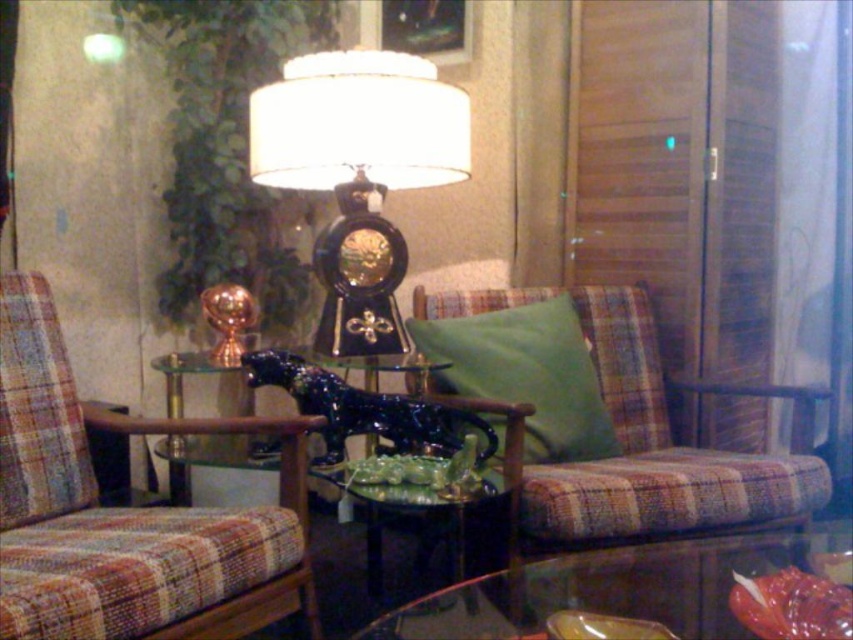
Can you confirm if green glossy side table at center is positioned to the right of shiny dark blue statue at center?

Correct, you'll find green glossy side table at center to the right of shiny dark blue statue at center.

Does green glossy side table at center appear on the left side of shiny dark blue statue at center?

No, green glossy side table at center is not to the left of shiny dark blue statue at center.

Is point (476, 522) farther from camera compared to point (350, 369)?

No, it is not.

The height and width of the screenshot is (640, 853). Find the location of `green glossy side table at center`. green glossy side table at center is located at coordinates (437, 520).

Does point (302, 54) come farther from viewer compared to point (498, 310)?

That is True.

Is point (276, 186) closer to viewer compared to point (463, 317)?

No, it is not.

The image size is (853, 640). I want to click on black glass clock at center, so click(358, 173).

Which is more to the left, transparent glass table at lower center or green fabric pillow at center?

Positioned to the left is green fabric pillow at center.

Does transparent glass table at lower center appear on the right side of green fabric pillow at center?

Indeed, transparent glass table at lower center is positioned on the right side of green fabric pillow at center.

Who is more forward, (523, 586) or (556, 388)?

Positioned in front is point (523, 586).

The image size is (853, 640). I want to click on transparent glass table at lower center, so click(614, 588).